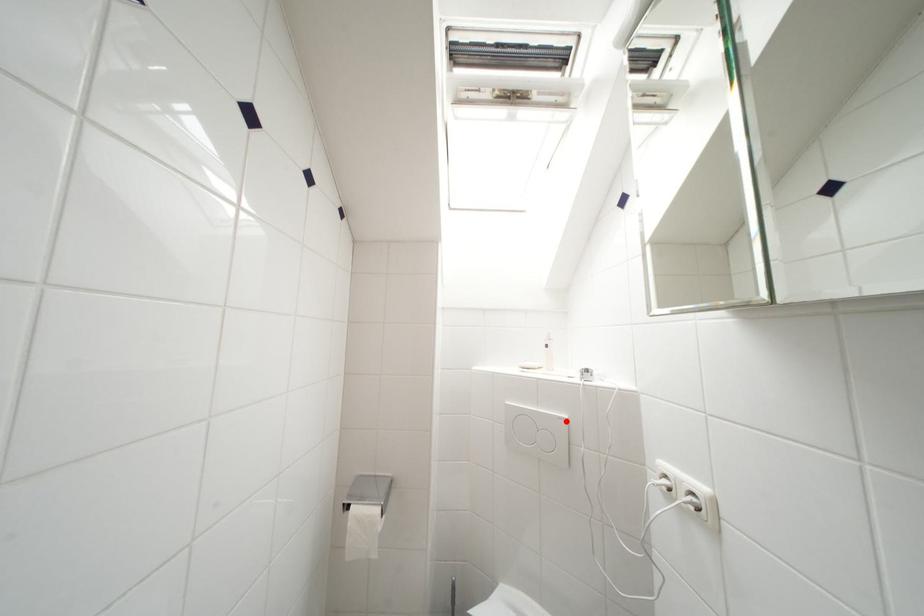
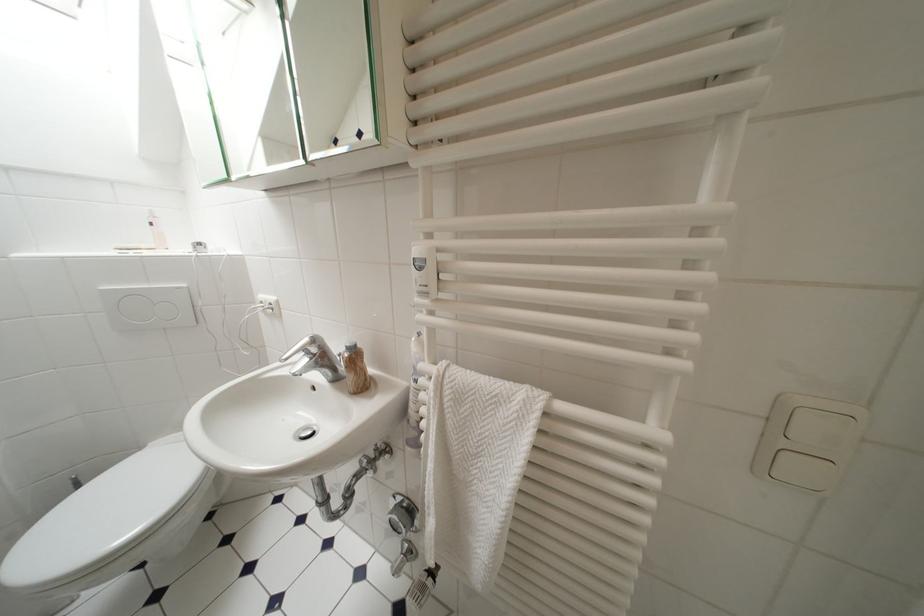
The point at the highlighted location is marked in the first image. Where is the corresponding point in the second image?

(185, 291)